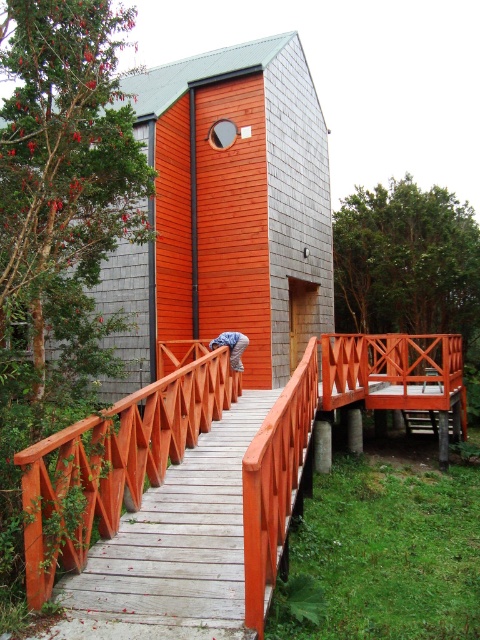
You are standing in front of the modern two story building. You see two points marked on the walkway leading to the entrance. Which point is closer to you, point (x=272, y=428) or point (x=228, y=388)?

Point (x=272, y=428) is closer to the viewer than point (x=228, y=388).